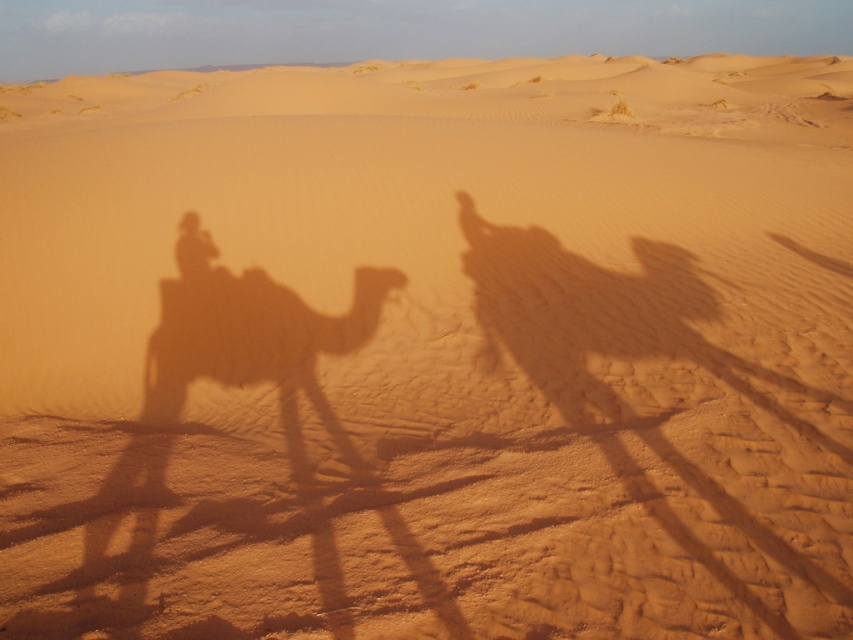
Question: Is brown textured camel at left thinner than smooth sand camel at center?

Choices:
 (A) yes
 (B) no

Answer: (B)

Question: Among these points, which one is farthest from the camera?

Choices:
 (A) (181, 276)
 (B) (178, 380)

Answer: (A)

Question: Which point appears closest to the camera in this image?

Choices:
 (A) (178, 232)
 (B) (300, 387)

Answer: (B)

Question: In this image, where is brown textured camel at left located relative to smooth sand camel at center?

Choices:
 (A) left
 (B) right

Answer: (B)

Question: Can you confirm if brown textured camel at left is smaller than smooth sand camel at center?

Choices:
 (A) yes
 (B) no

Answer: (B)